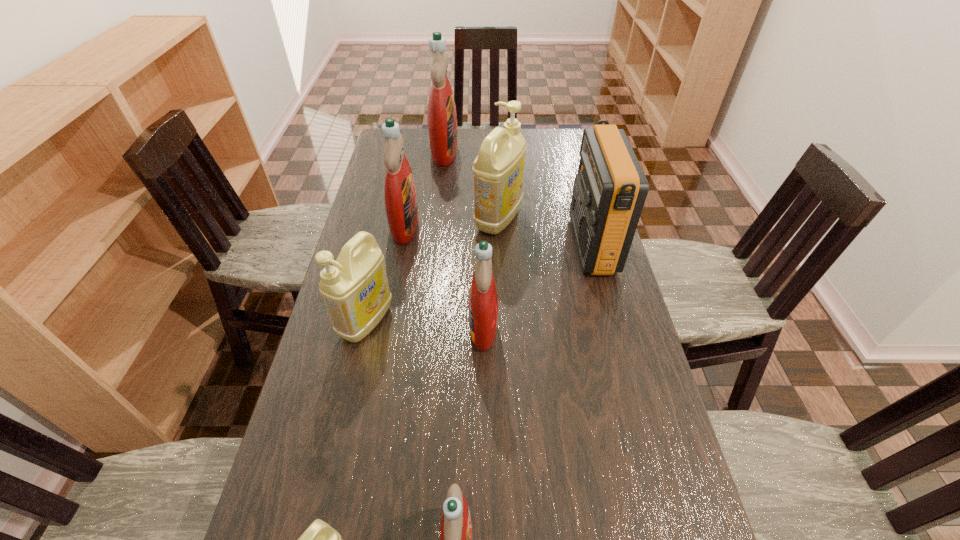
Where is `free space at the far edge of the desktop`? This screenshot has height=540, width=960. free space at the far edge of the desktop is located at coordinates (462, 133).

Find the location of `vacant region at the left edge`. vacant region at the left edge is located at coordinates (386, 237).

Identify the location of vacant space at the right edge of the desktop. (643, 509).

Image resolution: width=960 pixels, height=540 pixels. In order to click on free point at the far left corner in this screenshot , I will do `click(413, 133)`.

Find the location of a particular element. vacant area between the second biggest beige detergent and the third farthest red detergent is located at coordinates (424, 325).

Image resolution: width=960 pixels, height=540 pixels. Identify the location of empty space that is in between the rightmost beige detergent and the radio receiver. (545, 232).

The height and width of the screenshot is (540, 960). What are the coordinates of `free point between the farthest beige detergent and the rightmost object` in the screenshot? It's located at (545, 232).

This screenshot has height=540, width=960. Identify the location of vacant area between the biggest red detergent and the third farthest red detergent. (464, 239).

Point out which object is positioned as the fifth nearest to the farthest object. Please provide its 2D coordinates. Your answer should be formatted as a tuple, i.e. [(x, y)], where the tuple contains the x and y coordinates of a point satisfying the conditions above.

[(483, 301)]

Locate which object ranks fourth in proximity to the radio receiver. Please provide its 2D coordinates. Your answer should be formatted as a tuple, i.e. [(x, y)], where the tuple contains the x and y coordinates of a point satisfying the conditions above.

[(401, 204)]